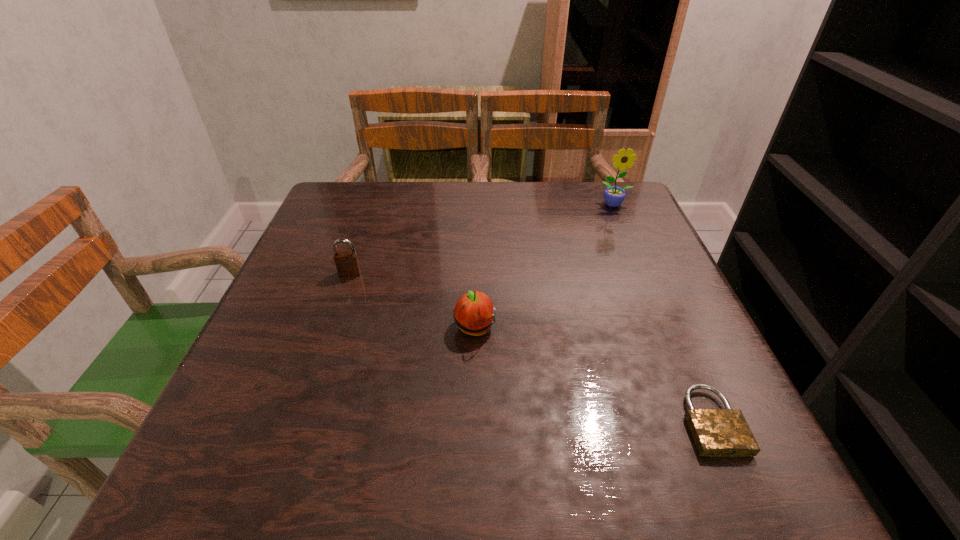
Image resolution: width=960 pixels, height=540 pixels. In order to click on the tallest object in this screenshot , I will do `click(614, 196)`.

The height and width of the screenshot is (540, 960). What are the coordinates of `the farthest object` in the screenshot? It's located at (614, 196).

The image size is (960, 540). What are the coordinates of `the farther padlock` in the screenshot? It's located at (347, 263).

Identify the location of the left padlock. Image resolution: width=960 pixels, height=540 pixels. (347, 263).

Identify the location of apple. (474, 312).

At what (x,y) coordinates should I click in order to perform the action: click on the third object from right to left. Please return your answer as a coordinate pair (x, y). The height and width of the screenshot is (540, 960). Looking at the image, I should click on (474, 312).

Locate an element on the screen. This screenshot has width=960, height=540. the shorter padlock is located at coordinates (716, 432).

I want to click on the nearer padlock, so click(716, 432).

Image resolution: width=960 pixels, height=540 pixels. Identify the location of vacant position located on the front-facing side of the tallest object. (641, 266).

I want to click on free space located on the front-facing side of the left padlock, so click(314, 380).